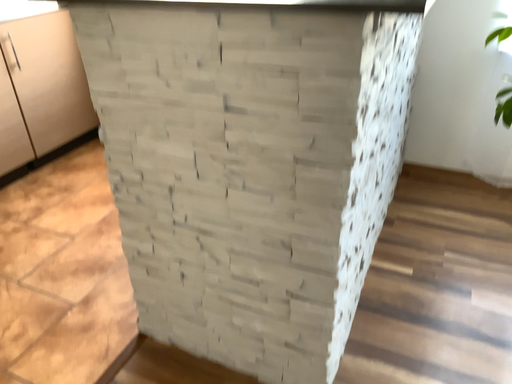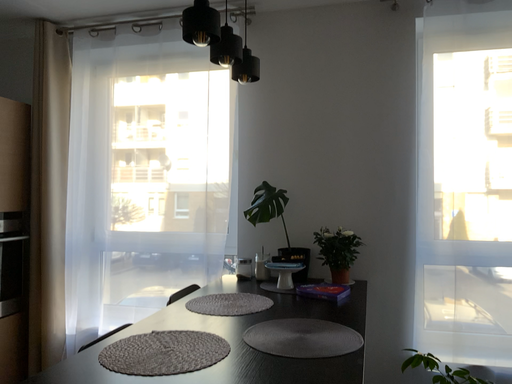
Question: How did the camera likely rotate when shooting the video?

Choices:
 (A) rotated downward
 (B) rotated upward

Answer: (B)